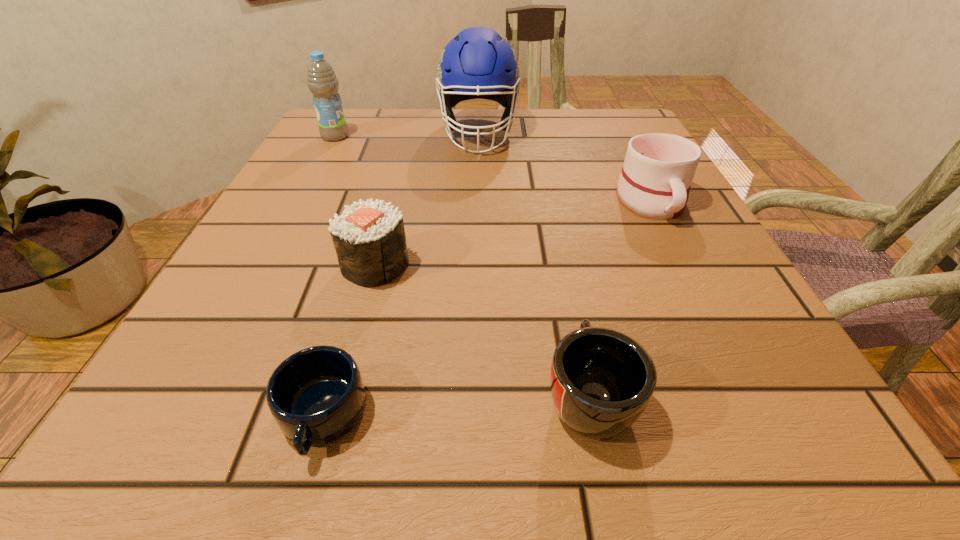
In order to click on free space between the sushi and the leftmost object in this screenshot , I will do click(355, 201).

Locate an element on the screen. vacant space in between the fourth farthest object and the leftmost object is located at coordinates (355, 201).

Identify the location of free area in between the football helmet and the sushi. The height and width of the screenshot is (540, 960). (427, 198).

At what (x,y) coordinates should I click in order to perform the action: click on free spot between the shortest mug and the second mug from left to right. Please return your answer as a coordinate pair (x, y). The width and height of the screenshot is (960, 540). Looking at the image, I should click on (455, 406).

This screenshot has height=540, width=960. I want to click on vacant region between the leftmost mug and the tallest object, so click(400, 274).

Where is `free spot between the second shortest mug and the rightmost mug`? free spot between the second shortest mug and the rightmost mug is located at coordinates (620, 298).

Locate an element on the screen. empty space between the second shortest mug and the leftmost object is located at coordinates (462, 266).

Image resolution: width=960 pixels, height=540 pixels. What are the coordinates of `vacant point located between the fourth farthest object and the tallest object` in the screenshot? It's located at (427, 198).

This screenshot has width=960, height=540. I want to click on object that stands as the fourth closest to the second mug from right to left, so click(478, 63).

Locate an element on the screen. the closest object to the second shortest mug is located at coordinates (316, 395).